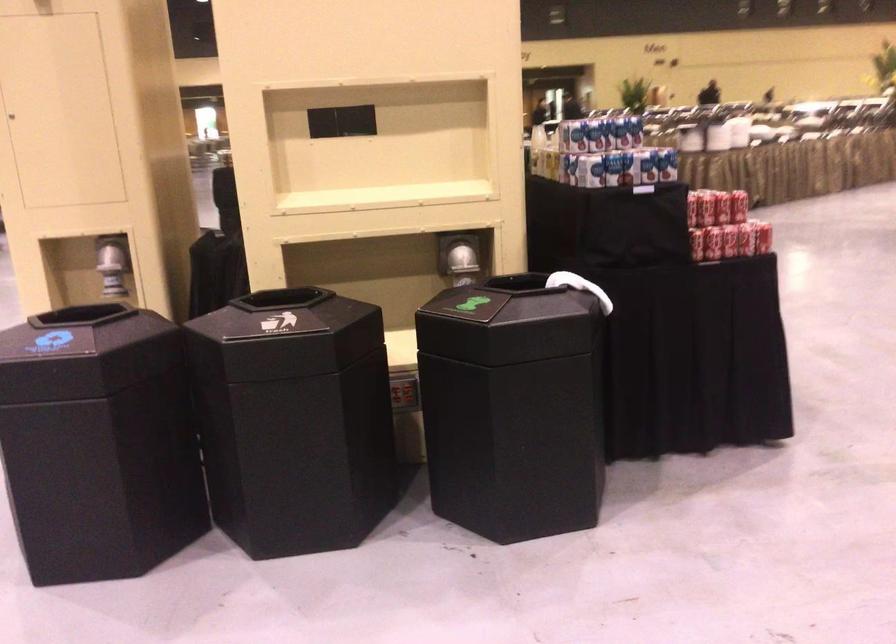
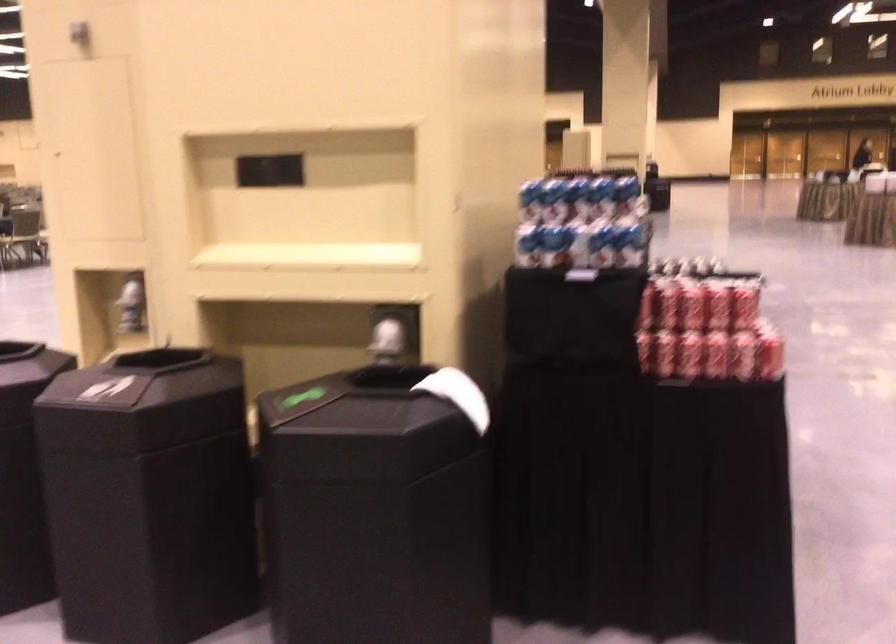
Find the pixel in the second image that matches [650,166] in the first image.

(600, 245)